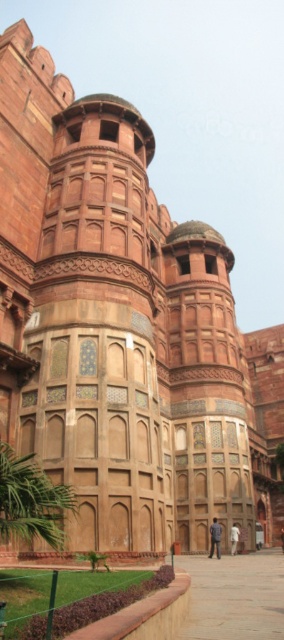
Does blue denim jacket at center have a greater width compared to dark blue fabric at center?

Indeed, blue denim jacket at center has a greater width compared to dark blue fabric at center.

Is blue denim jacket at center to the right of dark blue fabric at center from the viewer's perspective?

Incorrect, blue denim jacket at center is not on the right side of dark blue fabric at center.

Which is behind, point (209, 528) or point (234, 548)?

The point (234, 548) is more distant.

The height and width of the screenshot is (640, 284). Find the location of `blue denim jacket at center`. blue denim jacket at center is located at coordinates (214, 538).

Which is in front, point (214, 522) or point (282, 548)?

Point (214, 522) is more forward.

The width and height of the screenshot is (284, 640). In order to click on blue denim jacket at center in this screenshot , I will do `click(214, 538)`.

Does dark blue fabric at center have a larger size compared to dark brown leather jacket at center?

Indeed, dark blue fabric at center has a larger size compared to dark brown leather jacket at center.

Between dark blue fabric at center and dark brown leather jacket at center, which one has less height?

dark blue fabric at center

I want to click on dark blue fabric at center, so click(x=234, y=538).

Find the location of a particular element. This screenshot has width=284, height=640. dark blue fabric at center is located at coordinates pyautogui.click(x=234, y=538).